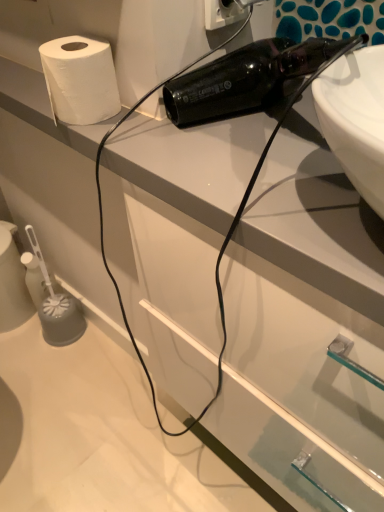
In order to click on white plastic electric outlet at upper center in this screenshot , I will do `click(223, 13)`.

Measure the distance between point [218,24] and camera.

Point [218,24] and camera are 63.40 centimeters apart.

Image resolution: width=384 pixels, height=512 pixels. What do you see at coordinates (223, 13) in the screenshot?
I see `white plastic electric outlet at upper center` at bounding box center [223, 13].

This screenshot has height=512, width=384. Describe the element at coordinates (80, 80) in the screenshot. I see `white matte paper towel at upper left` at that location.

In order to click on white matte paper towel at upper left in this screenshot , I will do `click(80, 80)`.

Locate an element on the screen. The height and width of the screenshot is (512, 384). white plastic electric outlet at upper center is located at coordinates (223, 13).

Which object is positioned more to the left, white matte paper towel at upper left or white plastic electric outlet at upper center?

white matte paper towel at upper left is more to the left.

In the image, is white matte paper towel at upper left positioned in front of or behind white plastic electric outlet at upper center?

white matte paper towel at upper left is positioned farther from the viewer than white plastic electric outlet at upper center.

Which is further, (108, 75) or (231, 14)?

The point (231, 14) is more distant.

From the image's perspective, relative to white plastic electric outlet at upper center, is white matte paper towel at upper left above or below?

Based on their image positions, white matte paper towel at upper left is located beneath white plastic electric outlet at upper center.

From a real-world perspective, is white matte paper towel at upper left physically above white plastic electric outlet at upper center?

No, from a real-world perspective, white matte paper towel at upper left is not over white plastic electric outlet at upper center

Which of these two, white matte paper towel at upper left or white plastic electric outlet at upper center, is thinner?

white plastic electric outlet at upper center is thinner.

Can you confirm if white matte paper towel at upper left is taller than white plastic electric outlet at upper center?

No.

In the scene shown: Is white matte paper towel at upper left smaller than white plastic electric outlet at upper center?

No, white matte paper towel at upper left is not smaller than white plastic electric outlet at upper center.

Is white plastic electric outlet at upper center completely or partially inside white matte paper towel at upper left?

No.

Are white matte paper towel at upper left and white plastic electric outlet at upper center beside each other?

They are not placed beside each other.

Is white matte paper towel at upper left oriented away from white plastic electric outlet at upper center?

That's not correct — white matte paper towel at upper left is not looking away from white plastic electric outlet at upper center.

What's the angular difference between white matte paper towel at upper left and white plastic electric outlet at upper center's facing directions?

white matte paper towel at upper left and white plastic electric outlet at upper center are facing 90 degrees away from each other.

Identify the location of paper towel that is below the white plastic electric outlet at upper center (from the image's perspective). This screenshot has height=512, width=384. (80, 80).

Is white plastic electric outlet at upper center at the left side of white matte paper towel at upper left?

Incorrect, white plastic electric outlet at upper center is not on the left side of white matte paper towel at upper left.

Is the position of white plastic electric outlet at upper center less distant than that of white matte paper towel at upper left?

Yes, white plastic electric outlet at upper center is in front of white matte paper towel at upper left.

Between point (225, 8) and point (69, 54), which one is positioned in front?

The point (69, 54) is more forward.

From the image's perspective, relative to white matte paper towel at upper left, is white plastic electric outlet at upper center above or below?

white plastic electric outlet at upper center is situated higher than white matte paper towel at upper left in the image.

From a real-world perspective, which is physically above, white plastic electric outlet at upper center or white matte paper towel at upper left?

In real-world perspective, white plastic electric outlet at upper center is above.

Considering the sizes of objects white plastic electric outlet at upper center and white matte paper towel at upper left in the image provided, who is wider, white plastic electric outlet at upper center or white matte paper towel at upper left?

With larger width is white matte paper towel at upper left.

Considering the relative sizes of white plastic electric outlet at upper center and white matte paper towel at upper left in the image provided, is white plastic electric outlet at upper center taller than white matte paper towel at upper left?

Indeed, white plastic electric outlet at upper center has a greater height compared to white matte paper towel at upper left.

Based on their sizes in the image, would you say white plastic electric outlet at upper center is bigger or smaller than white matte paper towel at upper left?

Clearly, white plastic electric outlet at upper center is smaller in size than white matte paper towel at upper left.

Is white matte paper towel at upper left inside white plastic electric outlet at upper center?

No, white matte paper towel at upper left is not surrounded by white plastic electric outlet at upper center.

Is there a large distance between white plastic electric outlet at upper center and white matte paper towel at upper left?

No, white plastic electric outlet at upper center is not far away from white matte paper towel at upper left.

Is white plastic electric outlet at upper center looking in the opposite direction of white matte paper towel at upper left?

No.

In the scene shown: Can you tell me how much white plastic electric outlet at upper center and white matte paper towel at upper left differ in facing direction?

90 degrees.

Locate an element on the screen. This screenshot has width=384, height=512. paper towel below the white plastic electric outlet at upper center (from the image's perspective) is located at coordinates (80, 80).

What are the coordinates of `electric outlet in front of the white matte paper towel at upper left` in the screenshot? It's located at (223, 13).

At what (x,y) coordinates should I click in order to perform the action: click on paper towel on the left of white plastic electric outlet at upper center. Please return your answer as a coordinate pair (x, y). This screenshot has width=384, height=512. Looking at the image, I should click on (80, 80).